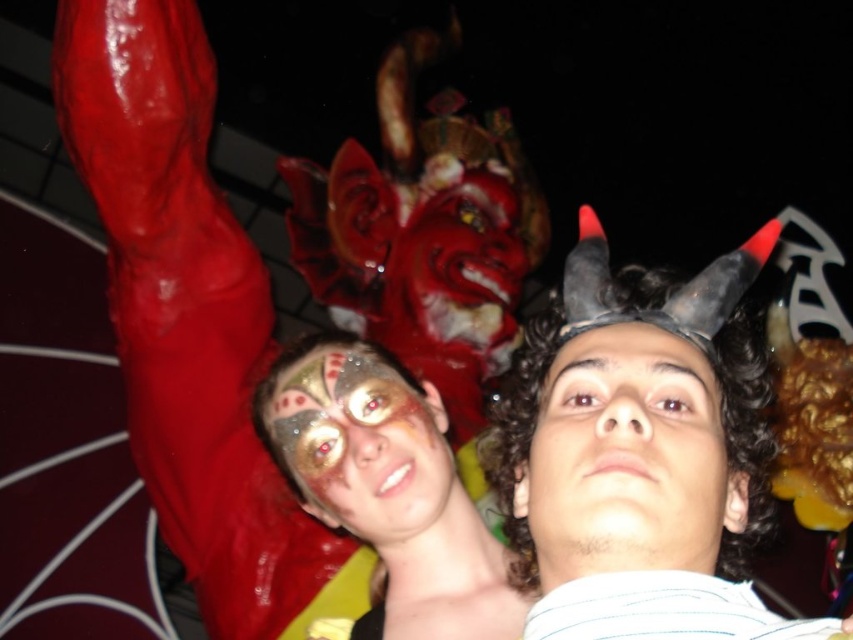
What is located at the point with coordinates (286, 353) in the image?

The point at (286, 353) has glossy red latex at upper left.

You are a photographer trying to capture both the matte gold face paint at center and the smooth skin face at center in a single frame. Based on their sizes, which one should you focus on to ensure both are visible without cropping?

The matte gold face paint at center is much taller than the smooth skin face at center, so focusing on the matte gold face paint at center will allow the smooth skin face at center to fit into the frame as well.